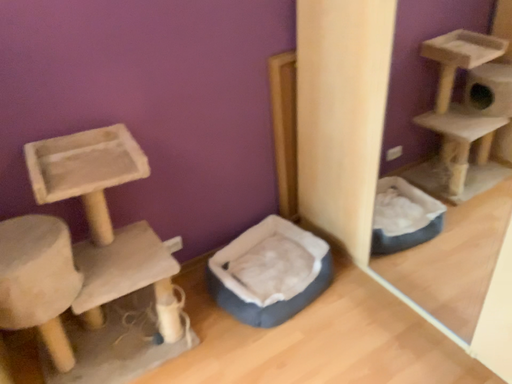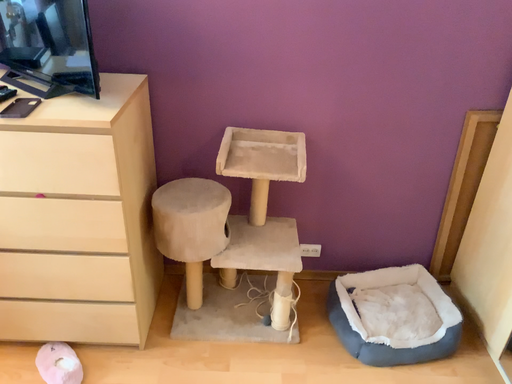
Question: How did the camera likely rotate when shooting the video?

Choices:
 (A) rotated upward
 (B) rotated downward

Answer: (A)